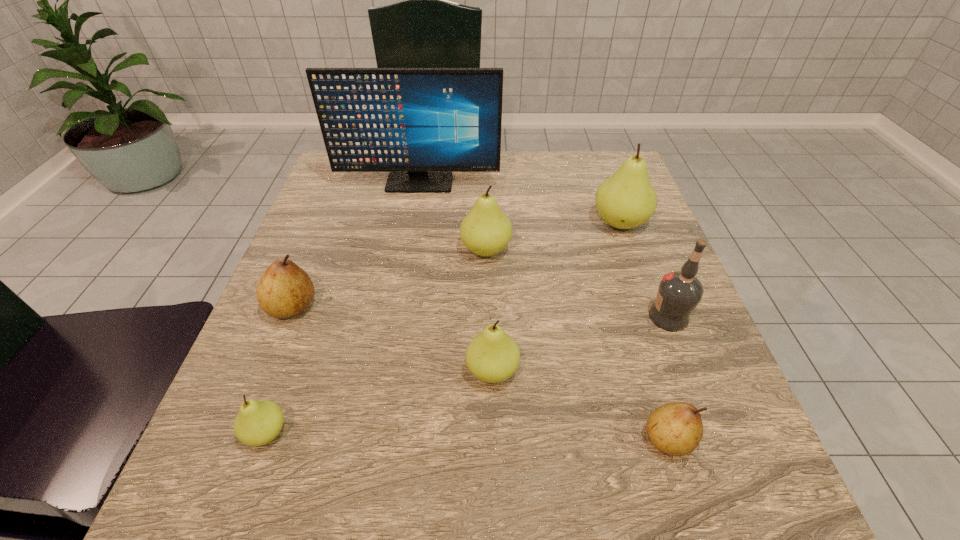
You are a GUI agent. You are given a task and a screenshot of the screen. Output one action in this format:
    pyautogui.click(x=<x>, y=<y>)
    Task: Click on the free location located 0.130m on the back of the left brown pear
    The width and height of the screenshot is (960, 540).
    Given the screenshot: What is the action you would take?
    pyautogui.click(x=317, y=246)

Find the location of a particular element. The width and height of the screenshot is (960, 540). vacant space located 0.380m on the left of the second nearest green pear is located at coordinates (241, 371).

This screenshot has height=540, width=960. Find the location of `free space located on the right of the smallest green pear`. free space located on the right of the smallest green pear is located at coordinates (421, 433).

Find the location of a particular element. This screenshot has width=960, height=540. free space located 0.090m on the right of the right brown pear is located at coordinates (753, 439).

Find the location of a particular element. The width and height of the screenshot is (960, 540). object that is at the far edge is located at coordinates (419, 124).

Find the location of a particular element. object located at the near edge is located at coordinates (676, 428).

Locate an element on the screen. This screenshot has width=960, height=540. computer monitor that is at the left edge is located at coordinates (419, 124).

The width and height of the screenshot is (960, 540). In order to click on vodka present at the right edge in this screenshot , I will do `click(679, 292)`.

Where is `object present at the far left corner`? object present at the far left corner is located at coordinates (419, 124).

Locate an element on the screen. Image resolution: width=960 pixels, height=540 pixels. object at the near right corner is located at coordinates [676, 428].